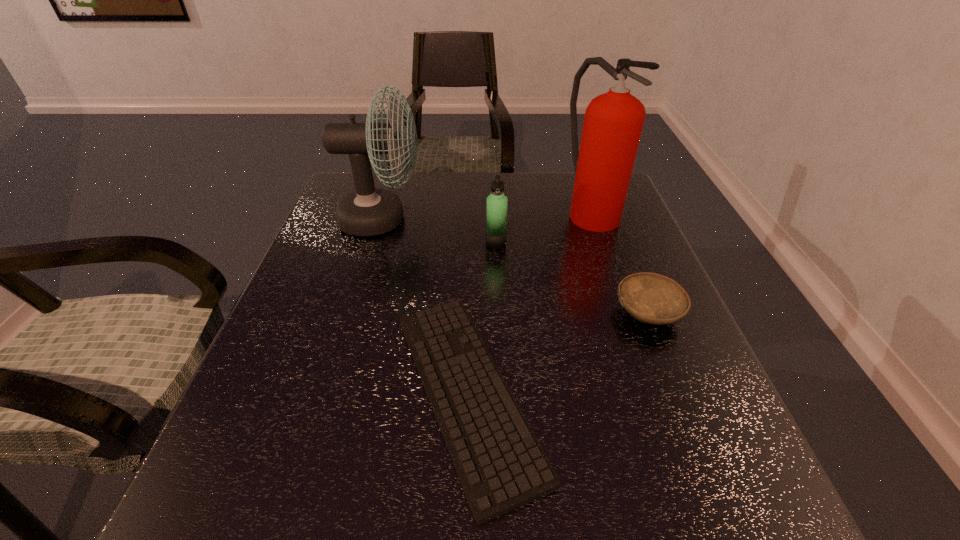
Find the location of a particular element. fire extinguisher is located at coordinates (613, 122).

You are a GUI agent. You are given a task and a screenshot of the screen. Output one action in this format:
    pyautogui.click(x=<x>, y=<y>)
    Task: Click on the fourth shortest object
    This screenshot has height=540, width=960.
    Given the screenshot: What is the action you would take?
    pyautogui.click(x=369, y=211)

Identify the location of the third tallest object. Image resolution: width=960 pixels, height=540 pixels. (496, 215).

The width and height of the screenshot is (960, 540). In order to click on bowl in this screenshot , I will do `click(650, 298)`.

You are a GUI agent. You are given a task and a screenshot of the screen. Output one action in this format:
    pyautogui.click(x=<x>, y=<y>)
    Task: Click on the shortest object
    The height and width of the screenshot is (540, 960).
    Given the screenshot: What is the action you would take?
    pyautogui.click(x=501, y=466)

The width and height of the screenshot is (960, 540). In order to click on free region located on the handle side of the tallest object in this screenshot , I will do `click(616, 282)`.

Locate an element on the screen. Image resolution: width=960 pixels, height=540 pixels. vacant point located in front of the second tallest object where the airflow is directed is located at coordinates (542, 219).

Where is `vacant area located 0.150m on the front of the thermos bottle`? vacant area located 0.150m on the front of the thermos bottle is located at coordinates (498, 290).

The height and width of the screenshot is (540, 960). Find the location of `vacant area located 0.210m on the back of the fourth tallest object`. vacant area located 0.210m on the back of the fourth tallest object is located at coordinates (617, 235).

Find the location of a particular element. The image size is (960, 540). vacant space located 0.100m on the right of the shortest object is located at coordinates (603, 392).